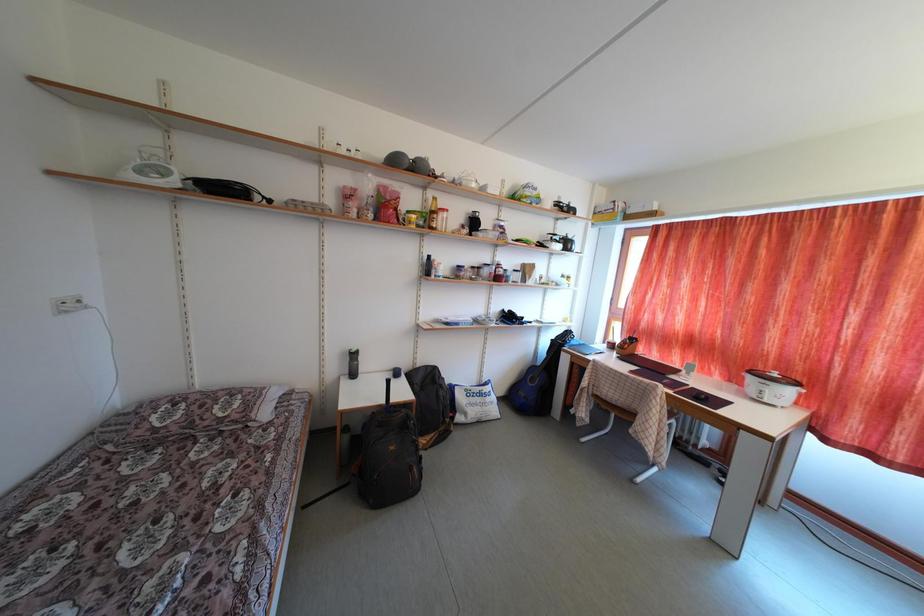
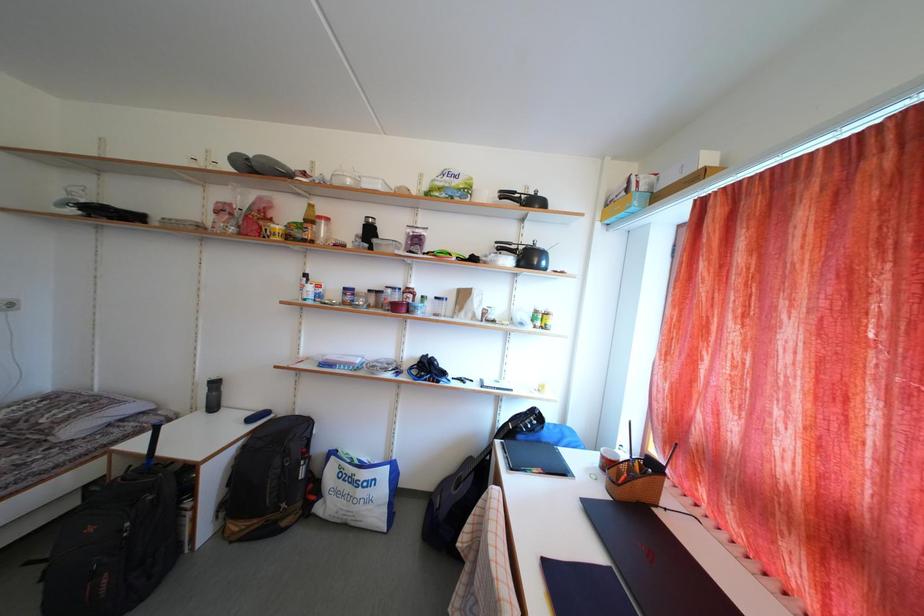
What movement of the cameraman would produce the second image?

The movement direction of the cameraman is right, forward.